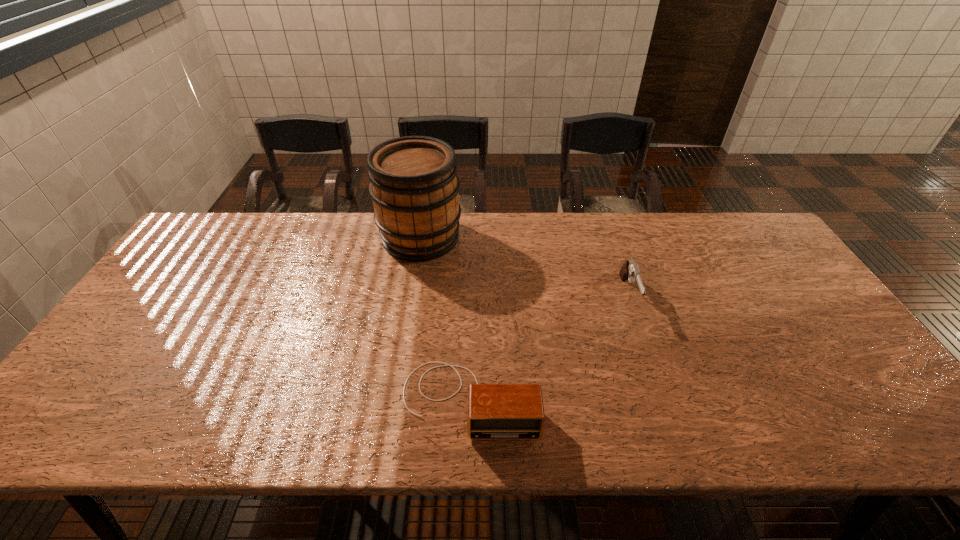
I want to click on free point between the gun and the radio receiver, so [x=549, y=347].

Locate an element on the screen. This screenshot has width=960, height=540. vacant area between the tallest object and the nearest object is located at coordinates (445, 318).

Where is `object that is the closest to the nearest object`? This screenshot has width=960, height=540. object that is the closest to the nearest object is located at coordinates (630, 270).

Find the location of `object that is the closest to the radio receiver`. object that is the closest to the radio receiver is located at coordinates (630, 270).